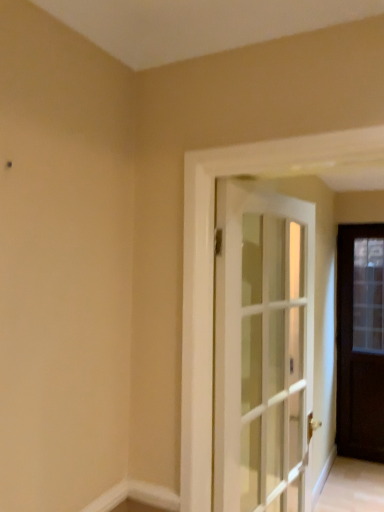
Question: Which direction should I rotate to look at white glass door at center, marked as the 2th door in a back-to-front arrangement?

Choices:
 (A) left
 (B) right

Answer: (B)

Question: From the image's perspective, is dark wood door at right, which is counted as the 2th door, starting from the left, under white glass door at center, acting as the second door starting from the right?

Choices:
 (A) yes
 (B) no

Answer: (A)

Question: From a real-world perspective, is dark wood door at right, the 1th door positioned from the back, located higher than white glass door at center, acting as the second door starting from the right?

Choices:
 (A) yes
 (B) no

Answer: (B)

Question: Does dark wood door at right, arranged as the first door when viewed from the right, have a greater height compared to white glass door at center, which ranks as the first door in front-to-back order?

Choices:
 (A) yes
 (B) no

Answer: (A)

Question: Does dark wood door at right, arranged as the first door when viewed from the right, lie in front of white glass door at center, which ranks as the first door in front-to-back order?

Choices:
 (A) yes
 (B) no

Answer: (B)

Question: Considering the relative sizes of dark wood door at right, which is counted as the 2th door, starting from the left, and white glass door at center, which ranks as the first door in front-to-back order, in the image provided, is dark wood door at right, which is counted as the 2th door, starting from the left, smaller than white glass door at center, which ranks as the first door in front-to-back order,?

Choices:
 (A) yes
 (B) no

Answer: (A)

Question: Would you consider dark wood door at right, which is the second door in front-to-back order, to be distant from white glass door at center, which ranks as the first door in front-to-back order?

Choices:
 (A) no
 (B) yes

Answer: (B)

Question: Considering the relative sizes of white smooth baseboard at lower center and dark wood door at right, which is counted as the 2th door, starting from the left, in the image provided, is white smooth baseboard at lower center bigger than dark wood door at right, which is counted as the 2th door, starting from the left,?

Choices:
 (A) no
 (B) yes

Answer: (A)

Question: Can you confirm if white smooth baseboard at lower center is positioned to the right of dark wood door at right, the 1th door positioned from the back?

Choices:
 (A) no
 (B) yes

Answer: (A)

Question: Is white smooth baseboard at lower center at the left side of dark wood door at right, which is the second door in front-to-back order?

Choices:
 (A) no
 (B) yes

Answer: (B)

Question: Considering the relative sizes of white smooth baseboard at lower center and dark wood door at right, arranged as the first door when viewed from the right, in the image provided, is white smooth baseboard at lower center taller than dark wood door at right, arranged as the first door when viewed from the right,?

Choices:
 (A) no
 (B) yes

Answer: (A)

Question: From a real-world perspective, is white smooth baseboard at lower center on dark wood door at right, which is the second door in front-to-back order?

Choices:
 (A) yes
 (B) no

Answer: (B)

Question: From the image's perspective, is white smooth baseboard at lower center beneath dark wood door at right, the 1th door positioned from the back?

Choices:
 (A) no
 (B) yes

Answer: (A)

Question: Is white glass door at center, the first door positioned from the left, with dark wood door at right, the 1th door positioned from the back?

Choices:
 (A) no
 (B) yes

Answer: (A)